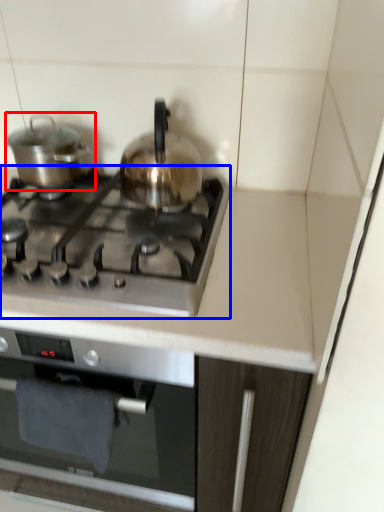
Question: Which object appears closest to the camera in this image, kitchen appliance (highlighted by a red box) or gas stove (highlighted by a blue box)?

Choices:
 (A) kitchen appliance
 (B) gas stove

Answer: (B)